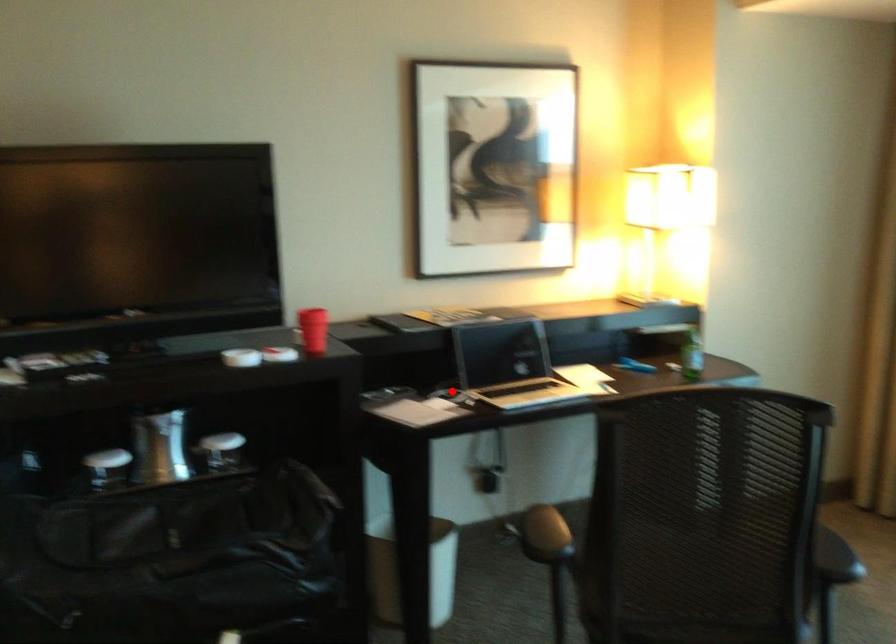
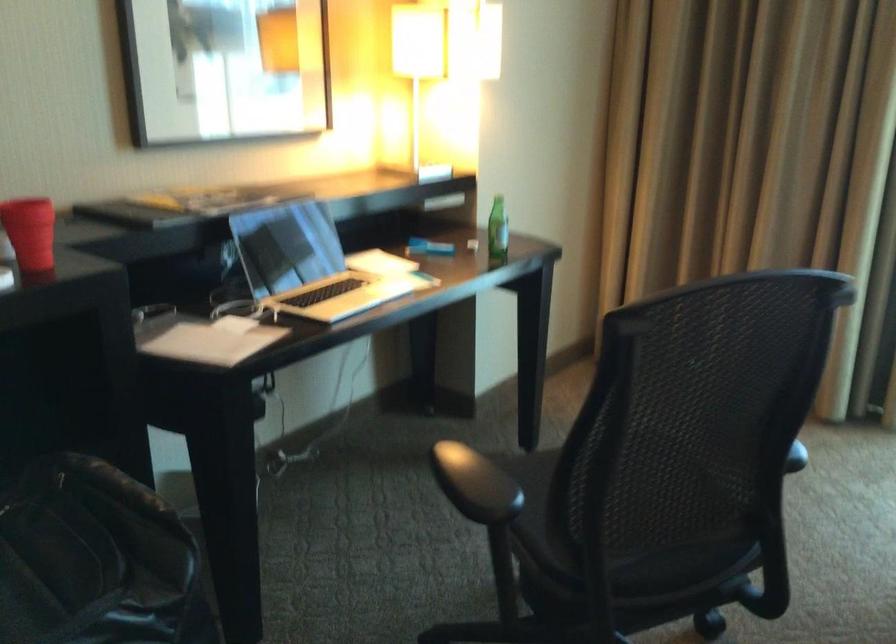
Question: I am providing you with two images of the same scene from different viewpoints. Image1 has a red point marked. In image2, the corresponding 3D location appears at what relative position? Reply with the corresponding letter.

Choices:
 (A) Closer
 (B) Farther

Answer: (A)